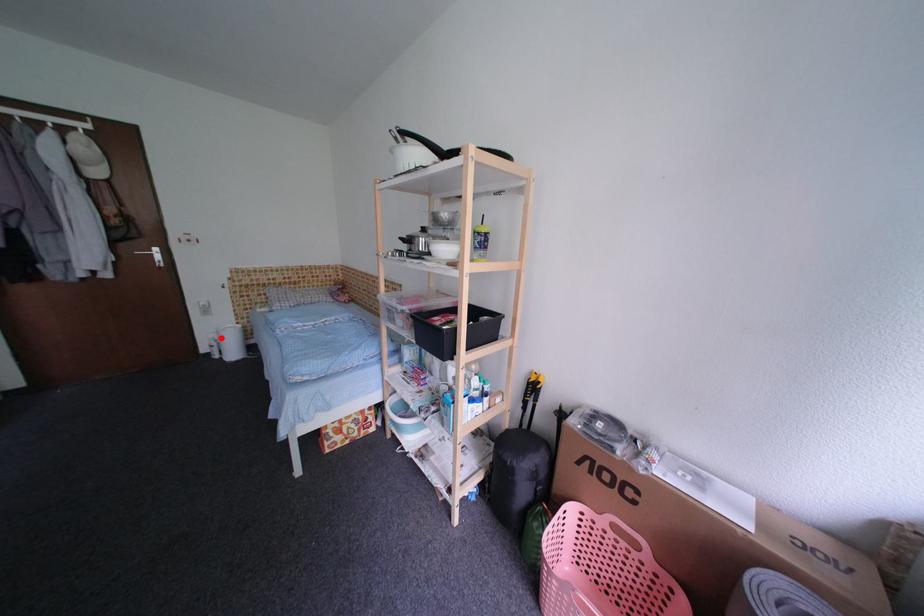
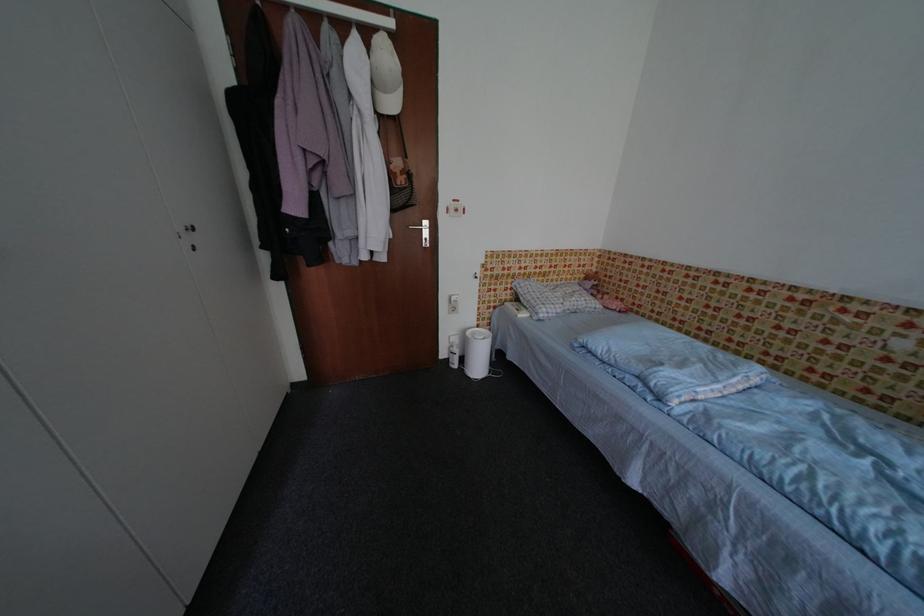
Question: I am providing you with two images of the same scene from different viewpoints. Image1 has a red point marked. In image2, the corresponding 3D location appears at what relative position? Reply with the corresponding letter.

Choices:
 (A) Closer
 (B) Farther

Answer: (B)